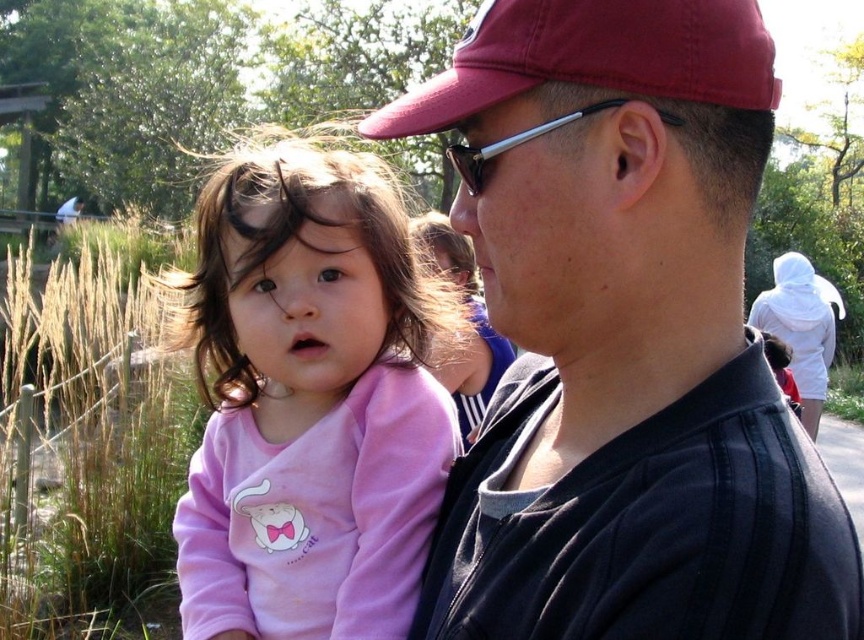
You are a photographer trying to capture the scene. The subject you want to focus on is at point (623,339). What object is located at that point?

The matte black shirt at center is located at point (623,339).

You are a photographer setting up a shot in the park. You notice the matte black shirt at center and the pink fleece at center. Which item should you focus on if you want to capture the smaller object in your frame?

The matte black shirt at center is smaller than the pink fleece at center, so you should focus on the matte black shirt at center to capture the smaller object in your frame.